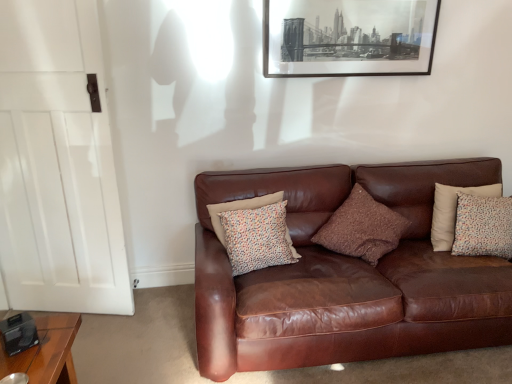
What do you see at coordinates (348, 37) in the screenshot?
I see `black matte picture frame at upper center` at bounding box center [348, 37].

In order to face black matte picture frame at upper center, should I rotate leftwards or rightwards?

Rotate right and turn 12.975 degrees.

Image resolution: width=512 pixels, height=384 pixels. I want to click on brown leather couch at center, so click(x=345, y=276).

Image resolution: width=512 pixels, height=384 pixels. What do you see at coordinates (257, 238) in the screenshot?
I see `multicolored fabric pillow at center, the 1th pillow when ordered from left to right` at bounding box center [257, 238].

This screenshot has height=384, width=512. In order to click on white wood door at left in this screenshot , I will do `click(57, 164)`.

Find the location of a particular element. Image resolution: width=512 pixels, height=384 pixels. black matte picture frame at upper center is located at coordinates (348, 37).

Looking at this image, is black matte picture frame at upper center at the left side of brown wooden table at lower left?

No, black matte picture frame at upper center is not to the left of brown wooden table at lower left.

Which point is more forward, (361, 24) or (56, 356)?

Positioned in front is point (56, 356).

Considering the sizes of objects black matte picture frame at upper center and brown wooden table at lower left in the image provided, who is bigger, black matte picture frame at upper center or brown wooden table at lower left?

With larger size is brown wooden table at lower left.

Does black matte picture frame at upper center have a lesser width compared to brown wooden table at lower left?

Correct, the width of black matte picture frame at upper center is less than that of brown wooden table at lower left.

Between point (445, 214) and point (5, 272), which one is positioned behind?

The point (5, 272) is behind.

Can you tell me how much patterned fabric pillow at right, which appears as the third pillow when viewed from the left, and white wood door at left differ in facing direction?

The angular difference between patterned fabric pillow at right, which appears as the third pillow when viewed from the left, and white wood door at left is 16.2 degrees.

Measure the distance from patterned fabric pillow at right, which is the 1th pillow in right-to-left order, to white wood door at left.

patterned fabric pillow at right, which is the 1th pillow in right-to-left order, is 7.27 feet from white wood door at left.

From a real-world perspective, is patterned fabric pillow at right, which appears as the third pillow when viewed from the left, physically below white wood door at left?

Yes, from a real-world perspective, patterned fabric pillow at right, which appears as the third pillow when viewed from the left, is below white wood door at left.

How distant is brown wooden table at lower left from patterned fabric pillow at right, which appears as the third pillow when viewed from the left?

brown wooden table at lower left and patterned fabric pillow at right, which appears as the third pillow when viewed from the left, are 2.16 meters apart.

Which is nearer, [41,325] or [483,190]?

The point [41,325] is more forward.

In terms of height, does brown wooden table at lower left look taller or shorter compared to patterned fabric pillow at right, which is the 1th pillow in right-to-left order?

Considering their sizes, brown wooden table at lower left has less height than patterned fabric pillow at right, which is the 1th pillow in right-to-left order.

Considering the sizes of objects brown wooden table at lower left and patterned fabric pillow at right, which is the 1th pillow in right-to-left order, in the image provided, who is thinner, brown wooden table at lower left or patterned fabric pillow at right, which is the 1th pillow in right-to-left order,?

With smaller width is patterned fabric pillow at right, which is the 1th pillow in right-to-left order.

Which object is positioned more to the right, brown wooden table at lower left or multicolored fabric pillow at center, the 1th pillow when ordered from left to right?

multicolored fabric pillow at center, the 1th pillow when ordered from left to right, is more to the right.

Is brown wooden table at lower left spatially inside multicolored fabric pillow at center, the 1th pillow when ordered from left to right, or outside of it?

brown wooden table at lower left cannot be found inside multicolored fabric pillow at center, the 1th pillow when ordered from left to right.

Which of these two, brown wooden table at lower left or multicolored fabric pillow at center, the 1th pillow when ordered from left to right, is thinner?

multicolored fabric pillow at center, the 1th pillow when ordered from left to right.

Considering the relative positions of white wood door at left and brown leather couch at center in the image provided, is white wood door at left to the right of brown leather couch at center from the viewer's perspective?

In fact, white wood door at left is to the left of brown leather couch at center.

Choose the correct answer: Is white wood door at left inside brown leather couch at center or outside it?

white wood door at left is not enclosed by brown leather couch at center.

Considering the positions of points (2, 158) and (422, 225), is point (2, 158) closer to camera compared to point (422, 225)?

That is True.

Can multicolored fabric pillow at center, positioned as the 3th pillow in right-to-left order, be found inside white wood door at left?

No.

Who is more distant, white wood door at left or multicolored fabric pillow at center, positioned as the 3th pillow in right-to-left order?

multicolored fabric pillow at center, positioned as the 3th pillow in right-to-left order, is behind.

Consider the image. Are white wood door at left and multicolored fabric pillow at center, positioned as the 3th pillow in right-to-left order, far apart?

They are positioned close to each other.

Is white wood door at left bigger than multicolored fabric pillow at center, the 1th pillow when ordered from left to right?

Correct, white wood door at left is larger in size than multicolored fabric pillow at center, the 1th pillow when ordered from left to right.

Can brown textured pillow at center, the second pillow positioned from the right, be found inside multicolored fabric pillow at center, the 1th pillow when ordered from left to right?

No.

Can you confirm if multicolored fabric pillow at center, positioned as the 3th pillow in right-to-left order, is taller than brown textured pillow at center, acting as the second pillow starting from the left?

Incorrect, the height of multicolored fabric pillow at center, positioned as the 3th pillow in right-to-left order, is not larger of that of brown textured pillow at center, acting as the second pillow starting from the left.

Is multicolored fabric pillow at center, positioned as the 3th pillow in right-to-left order, oriented towards brown textured pillow at center, acting as the second pillow starting from the left?

No, multicolored fabric pillow at center, positioned as the 3th pillow in right-to-left order, is not aimed at brown textured pillow at center, acting as the second pillow starting from the left.

Relative to brown textured pillow at center, acting as the second pillow starting from the left, is multicolored fabric pillow at center, the 1th pillow when ordered from left to right, in front or behind?

In the image, multicolored fabric pillow at center, the 1th pillow when ordered from left to right, appears in front of brown textured pillow at center, acting as the second pillow starting from the left.

The width and height of the screenshot is (512, 384). What are the coordinates of `picture frame that appears above the brown wooden table at lower left (from the image's perspective)` in the screenshot? It's located at (348, 37).

Find the location of a particular element. door above the patterned fabric pillow at right, which appears as the third pillow when viewed from the left (from a real-world perspective) is located at coordinates tap(57, 164).

When comparing their distances from patterned fabric pillow at right, which appears as the third pillow when viewed from the left, does multicolored fabric pillow at center, the 1th pillow when ordered from left to right, or brown textured pillow at center, the second pillow positioned from the right, seem closer?

brown textured pillow at center, the second pillow positioned from the right, is positioned closer to the anchor patterned fabric pillow at right, which appears as the third pillow when viewed from the left.

Considering their positions, is brown wooden table at lower left positioned further to patterned fabric pillow at right, which appears as the third pillow when viewed from the left, than black matte picture frame at upper center?

Based on the image, brown wooden table at lower left appears to be further to patterned fabric pillow at right, which appears as the third pillow when viewed from the left.

From the image, which object appears to be nearer to brown leather couch at center, patterned fabric pillow at right, which appears as the third pillow when viewed from the left, or brown textured pillow at center, the second pillow positioned from the right?

brown textured pillow at center, the second pillow positioned from the right, lies closer to brown leather couch at center than the other object.

Looking at the image, which one is located further to brown leather couch at center, brown wooden table at lower left or white wood door at left?

brown wooden table at lower left lies further to brown leather couch at center than the other object.

From the image, which object appears to be farther from black matte picture frame at upper center, brown leather couch at center or brown textured pillow at center, acting as the second pillow starting from the left?

brown leather couch at center is further to black matte picture frame at upper center.

Which object lies further to the anchor point brown leather couch at center, brown wooden table at lower left or black matte picture frame at upper center?

brown wooden table at lower left is further to brown leather couch at center.

Based on their spatial positions, is black matte picture frame at upper center or white wood door at left further from brown leather couch at center?

white wood door at left.

Considering their positions, is black matte picture frame at upper center positioned closer to patterned fabric pillow at right, which appears as the third pillow when viewed from the left, than multicolored fabric pillow at center, the 1th pillow when ordered from left to right?

black matte picture frame at upper center is closer to patterned fabric pillow at right, which appears as the third pillow when viewed from the left.

Locate an element on the screen. The image size is (512, 384). table between white wood door at left and brown textured pillow at center, acting as the second pillow starting from the left, from left to right is located at coordinates (46, 351).

The width and height of the screenshot is (512, 384). In order to click on studio couch located between brown wooden table at lower left and brown textured pillow at center, the second pillow positioned from the right, in the left-right direction in this screenshot , I will do `click(345, 276)`.

The image size is (512, 384). Find the location of `studio couch located between white wood door at left and brown textured pillow at center, the second pillow positioned from the right, in the left-right direction`. studio couch located between white wood door at left and brown textured pillow at center, the second pillow positioned from the right, in the left-right direction is located at coordinates (345, 276).

Locate an element on the screen. The image size is (512, 384). studio couch located between white wood door at left and patterned fabric pillow at right, which is the 1th pillow in right-to-left order, in the left-right direction is located at coordinates (345, 276).